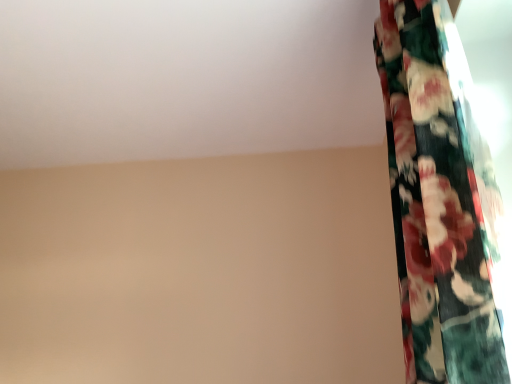
The height and width of the screenshot is (384, 512). What are the coordinates of `floral fabric curtain at right` in the screenshot? It's located at (439, 199).

This screenshot has width=512, height=384. Describe the element at coordinates (439, 199) in the screenshot. I see `floral fabric curtain at right` at that location.

The height and width of the screenshot is (384, 512). Find the location of `floral fabric curtain at right`. floral fabric curtain at right is located at coordinates (439, 199).